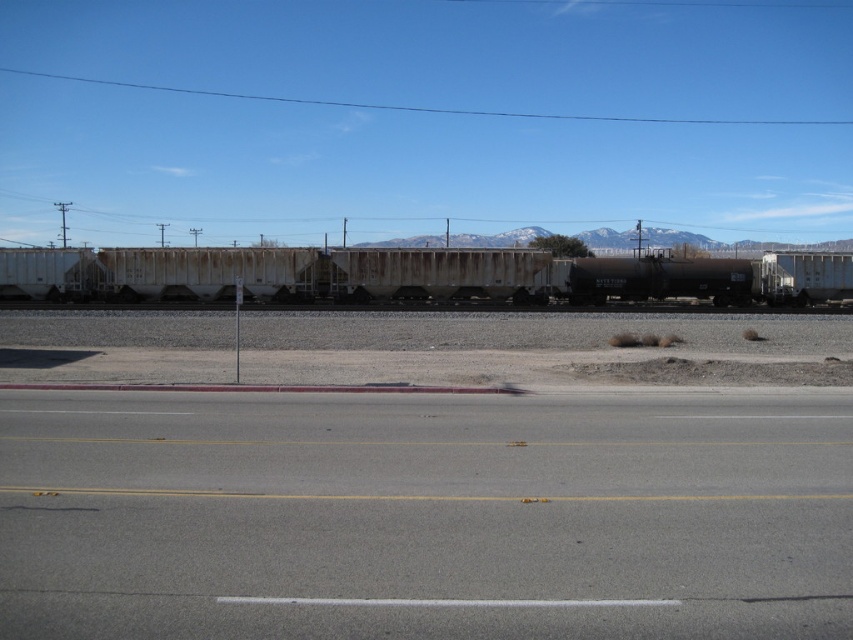
Question: Which point is farther to the camera?

Choices:
 (A) (624, 257)
 (B) (183, 506)

Answer: (A)

Question: Can you confirm if gray asphalt highway at center is thinner than rusty metal train car at center?

Choices:
 (A) no
 (B) yes

Answer: (B)

Question: Where is gray asphalt highway at center located in relation to rusty metal train car at center in the image?

Choices:
 (A) left
 (B) right

Answer: (B)

Question: Which of the following is the farthest from the observer?

Choices:
 (A) [410, 493]
 (B) [325, 276]

Answer: (B)

Question: Does gray asphalt highway at center lie in front of rusty metal train car at center?

Choices:
 (A) no
 (B) yes

Answer: (B)